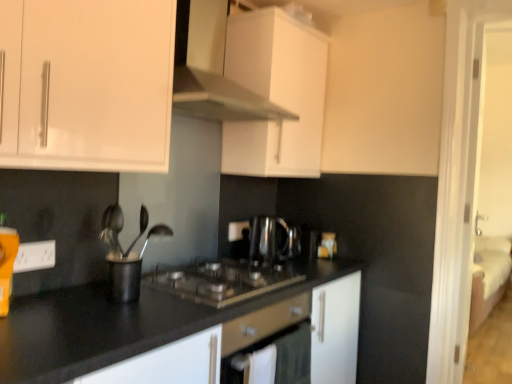
What are the coordinates of `free spot behind black matte utensil holder at center` in the screenshot? It's located at (146, 283).